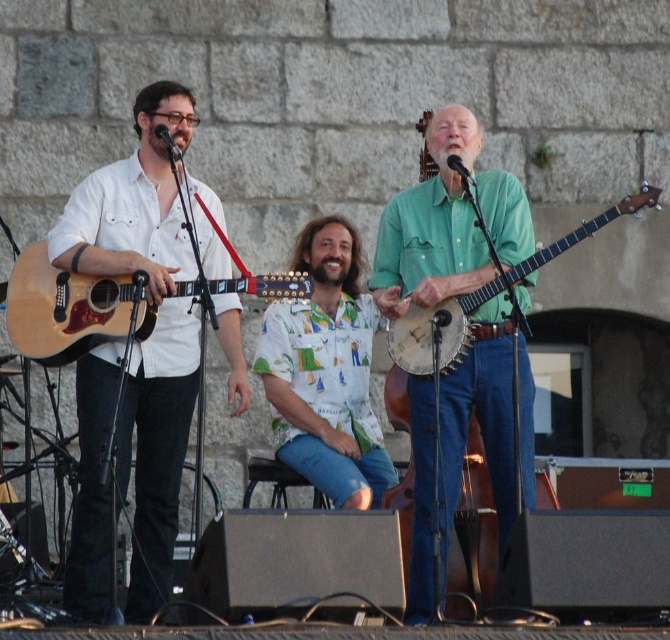
Can you confirm if green matte banjo at center is positioned above natural wood acoustic guitar at center?

No, green matte banjo at center is not above natural wood acoustic guitar at center.

Is green matte banjo at center positioned behind natural wood acoustic guitar at center?

No.

Does point (419, 195) come farther from viewer compared to point (86, 333)?

Yes, it is behind point (86, 333).

This screenshot has height=640, width=670. What are the coordinates of `green matte banjo at center` in the screenshot? It's located at (431, 227).

Which is below, matte white shirt at left or hawaiian print shirt at center?

Positioned lower is matte white shirt at left.

Does matte white shirt at left have a smaller size compared to hawaiian print shirt at center?

No.

I want to click on matte white shirt at left, so click(x=153, y=326).

Identify the location of matte white shirt at left. The height and width of the screenshot is (640, 670). pyautogui.click(x=153, y=326).

Is natural wood acoustic guitar at center wider than light brown wooden banjo at center?

In fact, natural wood acoustic guitar at center might be narrower than light brown wooden banjo at center.

Can you confirm if natural wood acoustic guitar at center is positioned to the right of light brown wooden banjo at center?

In fact, natural wood acoustic guitar at center is to the left of light brown wooden banjo at center.

Between point (40, 339) and point (452, 364), which one is positioned behind?

The point (452, 364) is behind.

Locate an element on the screen. This screenshot has width=670, height=640. natural wood acoustic guitar at center is located at coordinates (70, 308).